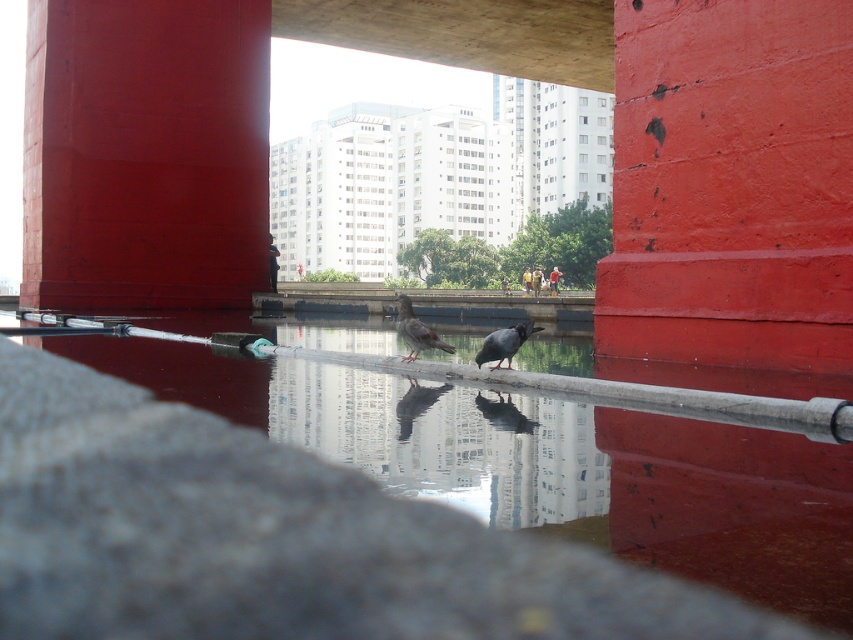
Where is `smooth concrete rail at center`? This screenshot has height=640, width=853. smooth concrete rail at center is located at coordinates (614, 392).

Is point (625, 401) farther from viewer compared to point (416, 348)?

No, it is not.

Is point (648, 404) farther from viewer compared to point (401, 337)?

No, (648, 404) is in front of (401, 337).

Where is `smooth concrete rail at center`? smooth concrete rail at center is located at coordinates (614, 392).

Is smooth red paint at center bigger than smooth red pillar at upper left?

Yes.

Is point (636, 280) behind point (115, 204)?

No, it is in front of (115, 204).

The height and width of the screenshot is (640, 853). Find the location of `smooth red paint at center`. smooth red paint at center is located at coordinates coord(730,195).

Does point (836, 413) lie in front of point (503, 339)?

Yes, it is in front of point (503, 339).

Does smooth concrete rail at center appear on the right side of matte gray bird at center?

Yes, smooth concrete rail at center is to the right of matte gray bird at center.

Does point (495, 372) lie in front of point (519, 339)?

That is True.

Locate an element on the screen. The width and height of the screenshot is (853, 640). smooth concrete rail at center is located at coordinates (614, 392).